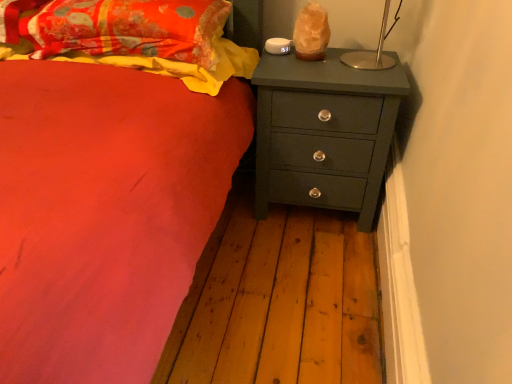
Question: Can you confirm if fluffy cotton blanket at upper left is smaller than matte dark green chest of drawers at right?

Choices:
 (A) no
 (B) yes

Answer: (B)

Question: Does fluffy cotton blanket at upper left have a lesser height compared to matte dark green chest of drawers at right?

Choices:
 (A) no
 (B) yes

Answer: (B)

Question: Is fluffy cotton blanket at upper left in contact with matte dark green chest of drawers at right?

Choices:
 (A) yes
 (B) no

Answer: (B)

Question: From a real-world perspective, is fluffy cotton blanket at upper left on top of matte dark green chest of drawers at right?

Choices:
 (A) yes
 (B) no

Answer: (A)

Question: Is fluffy cotton blanket at upper left far from matte dark green chest of drawers at right?

Choices:
 (A) yes
 (B) no

Answer: (B)

Question: Considering the relative sizes of fluffy cotton blanket at upper left and matte dark green chest of drawers at right in the image provided, is fluffy cotton blanket at upper left wider than matte dark green chest of drawers at right?

Choices:
 (A) yes
 (B) no

Answer: (B)

Question: Could you tell me if fluffy cotton blanket at upper left is turned towards floral fabric pillow at upper left?

Choices:
 (A) yes
 (B) no

Answer: (B)

Question: Is floral fabric pillow at upper left a part of fluffy cotton blanket at upper left?

Choices:
 (A) no
 (B) yes

Answer: (A)

Question: From a real-world perspective, is fluffy cotton blanket at upper left positioned under floral fabric pillow at upper left based on gravity?

Choices:
 (A) no
 (B) yes

Answer: (B)

Question: Considering the relative sizes of fluffy cotton blanket at upper left and floral fabric pillow at upper left in the image provided, is fluffy cotton blanket at upper left taller than floral fabric pillow at upper left?

Choices:
 (A) no
 (B) yes

Answer: (A)

Question: Considering the relative sizes of fluffy cotton blanket at upper left and floral fabric pillow at upper left in the image provided, is fluffy cotton blanket at upper left thinner than floral fabric pillow at upper left?

Choices:
 (A) yes
 (B) no

Answer: (B)

Question: Would you say fluffy cotton blanket at upper left is a long distance from floral fabric pillow at upper left?

Choices:
 (A) no
 (B) yes

Answer: (A)

Question: From the image's perspective, is floral fabric pillow at upper left below matte dark green chest of drawers at right?

Choices:
 (A) yes
 (B) no

Answer: (B)